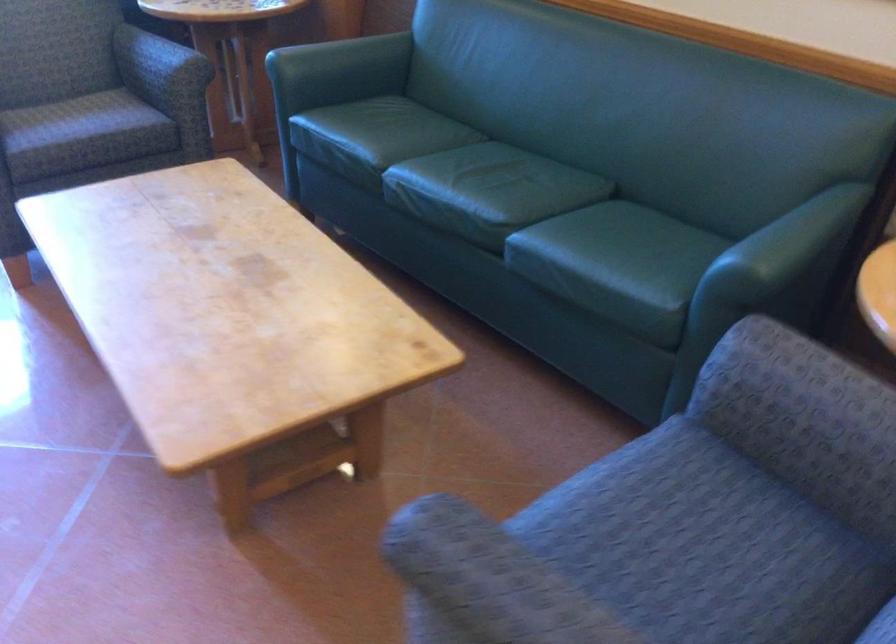
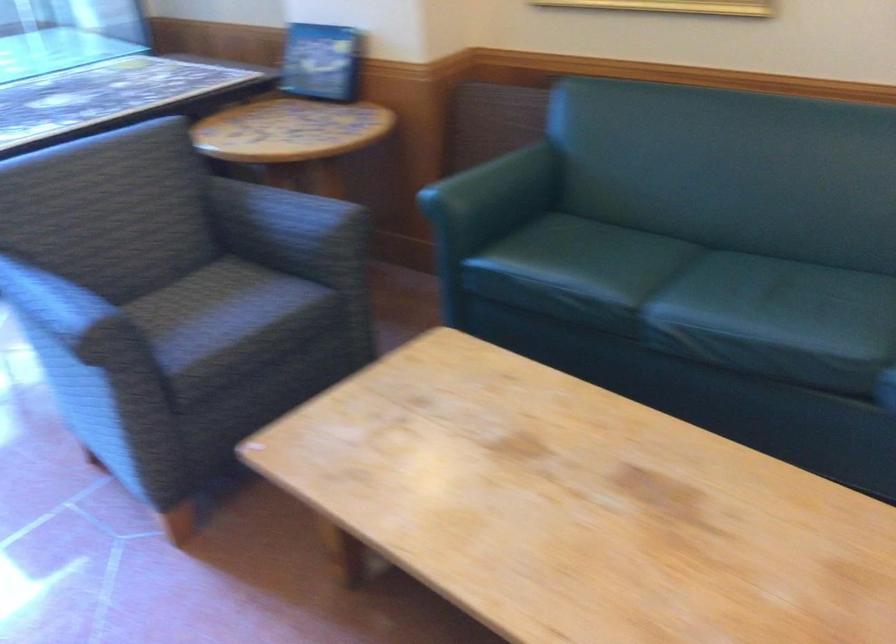
In the second image, find the point that corresponds to point 435,156 in the first image.

(679, 283)